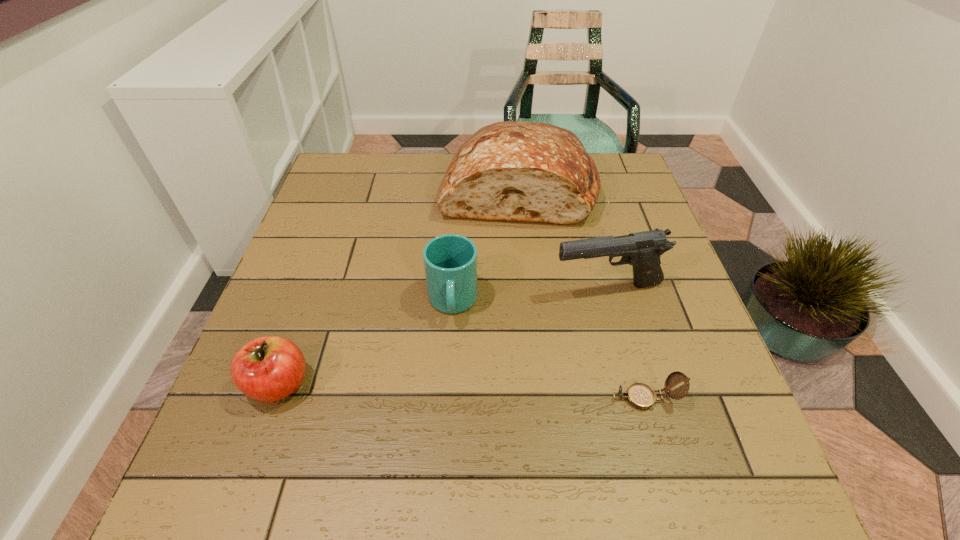
Where is `free space on the desktop that is between the second shortest object and the shortest object and is positioned at the muzzle of the second tallest object`? The width and height of the screenshot is (960, 540). free space on the desktop that is between the second shortest object and the shortest object and is positioned at the muzzle of the second tallest object is located at coordinates (504, 393).

At what (x,y) coordinates should I click in order to perform the action: click on vacant space on the desktop that is between the apple and the shortest object and is positioned at the sliced front of the tallest object. Please return your answer as a coordinate pair (x, y). Looking at the image, I should click on (470, 392).

You are a GUI agent. You are given a task and a screenshot of the screen. Output one action in this format:
    pyautogui.click(x=<x>, y=<y>)
    Task: Click on the vacant spot on the desktop that is between the apple and the compass and is positioned on the handle side of the cup
    
    Given the screenshot: What is the action you would take?
    pyautogui.click(x=451, y=391)